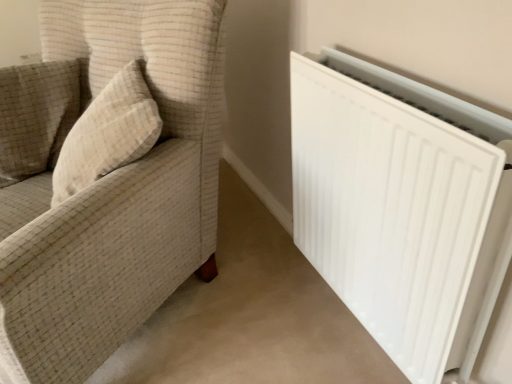
Question: Considering the relative positions of beige textured pillow at left and white matte radiator at right in the image provided, is beige textured pillow at left to the left or to the right of white matte radiator at right?

Choices:
 (A) right
 (B) left

Answer: (B)

Question: Is beige textured pillow at left wider or thinner than white matte radiator at right?

Choices:
 (A) wide
 (B) thin

Answer: (A)

Question: Which is farther from the white fabric couch at left?

Choices:
 (A) beige textured pillow at upper left
 (B) white matte radiator at right
 (C) beige textured pillow at left

Answer: (B)

Question: Which of these objects is positioned farthest from the beige textured pillow at left?

Choices:
 (A) beige textured pillow at upper left
 (B) white fabric couch at left
 (C) white matte radiator at right

Answer: (C)